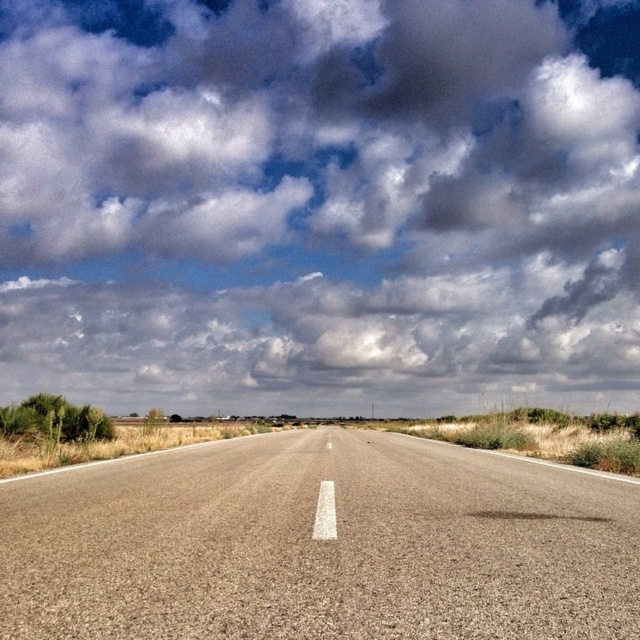
You are a photographer standing at the starting point of the road. You want to take a photo that includes both the point at (x=513, y=244) and the point at (x=26, y=580). Based on their positions, which point will appear closer to the bottom edge of the photo?

The point at (x=26, y=580) will appear closer to the bottom edge of the photo because it is closer to the camera than the point at (x=513, y=244).

You are a drone operator planning to fly a drone with a maximum flight altitude of 400 feet. You want to capture a photo of the cloudy sky at upper center and the asphalt road at center in the same frame. Based on the scene description, can the drone safely capture both objects without exceeding its altitude limit?

The distance between the cloudy sky at upper center and the asphalt road at center is 346.70 feet. Since the drone can fly up to 400 feet, it can safely capture both objects without exceeding its altitude limit as the required distance is less than the maximum altitude.